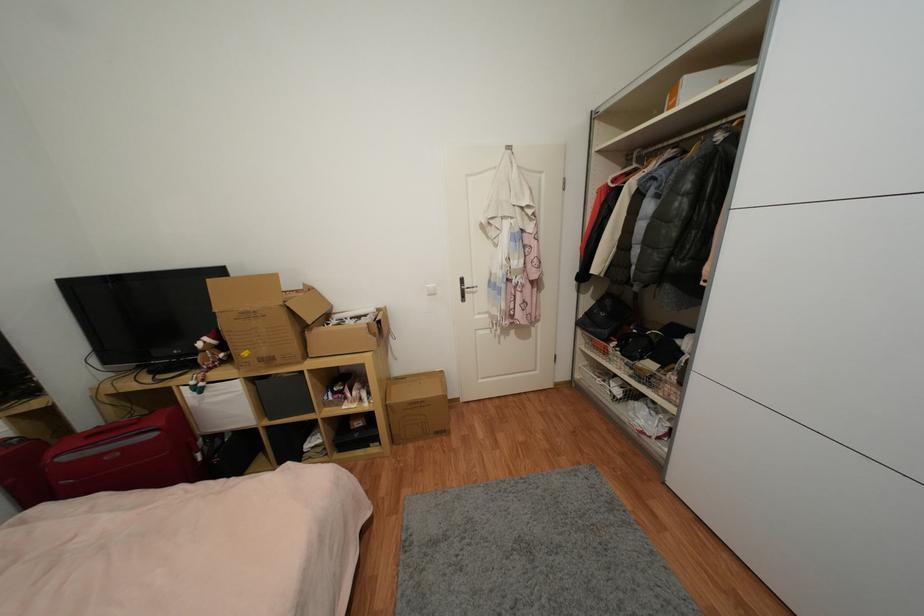
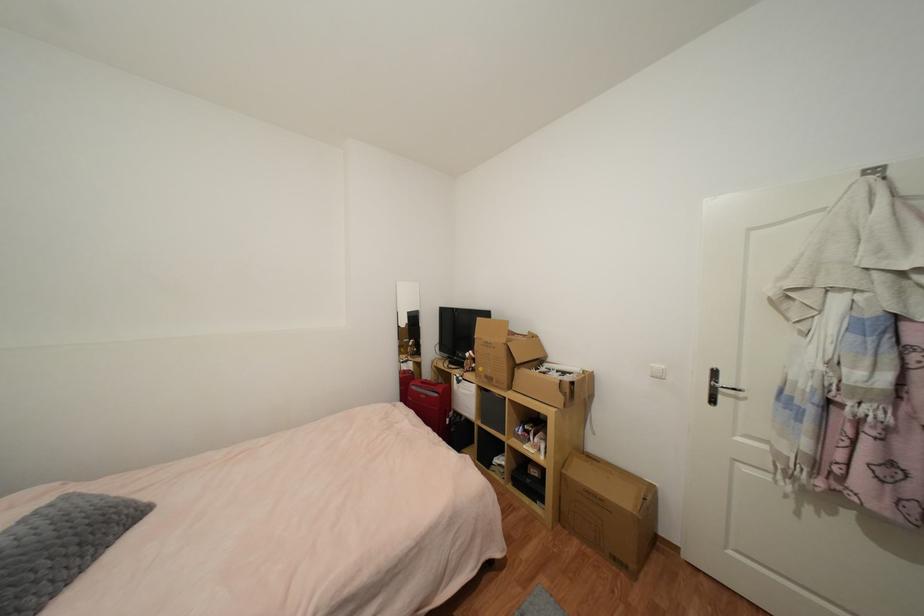
In the second image, find the point that corresponds to point 205,386 in the first image.

(465, 379)